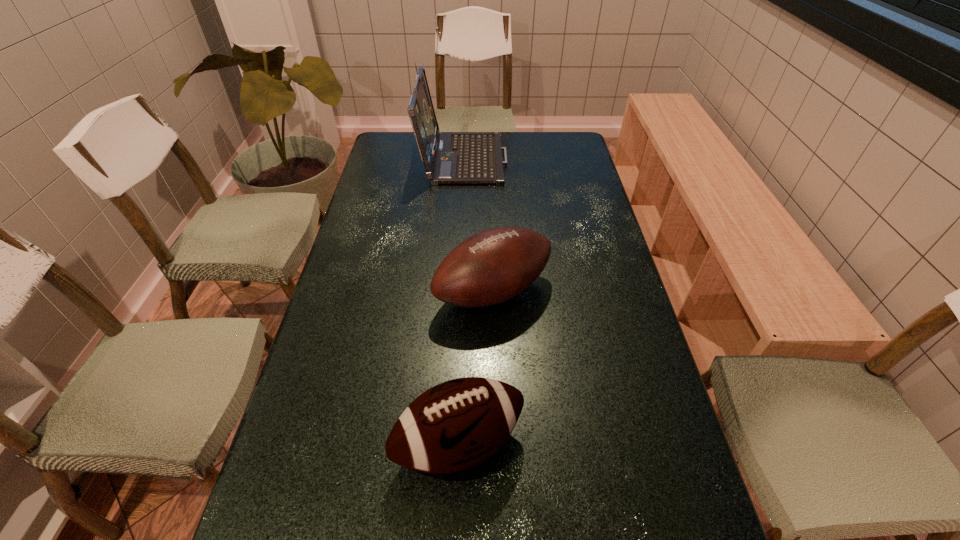
Find the location of `free space that satisfies the following two spatial constraints: 1. on the front-facing side of the laptop computer; 2. on the left side of the second nearest object`. free space that satisfies the following two spatial constraints: 1. on the front-facing side of the laptop computer; 2. on the left side of the second nearest object is located at coordinates (455, 292).

You are a GUI agent. You are given a task and a screenshot of the screen. Output one action in this format:
    pyautogui.click(x=<x>, y=<y>)
    Task: Click on the vacant region that satisfies the following two spatial constraints: 1. on the front-facing side of the laptop computer; 2. on the back side of the nearest object
    
    Given the screenshot: What is the action you would take?
    pyautogui.click(x=447, y=444)

Where is `vacant space that satisfies the following two spatial constraints: 1. on the front-facing side of the farthest object; 2. on the left side of the second farthest object`? vacant space that satisfies the following two spatial constraints: 1. on the front-facing side of the farthest object; 2. on the left side of the second farthest object is located at coordinates click(455, 292).

The width and height of the screenshot is (960, 540). What are the coordinates of `vacant region that satisfies the following two spatial constraints: 1. on the front-facing side of the laptop computer; 2. on the right side of the nearer football (American)` in the screenshot? It's located at (447, 444).

In order to click on free space that satisfies the following two spatial constraints: 1. on the back side of the farther football (American); 2. on the right side of the nearest object in this screenshot , I will do `click(465, 292)`.

I want to click on vacant space that satisfies the following two spatial constraints: 1. on the front-facing side of the tallest object; 2. on the back side of the nearest object, so click(x=447, y=444).